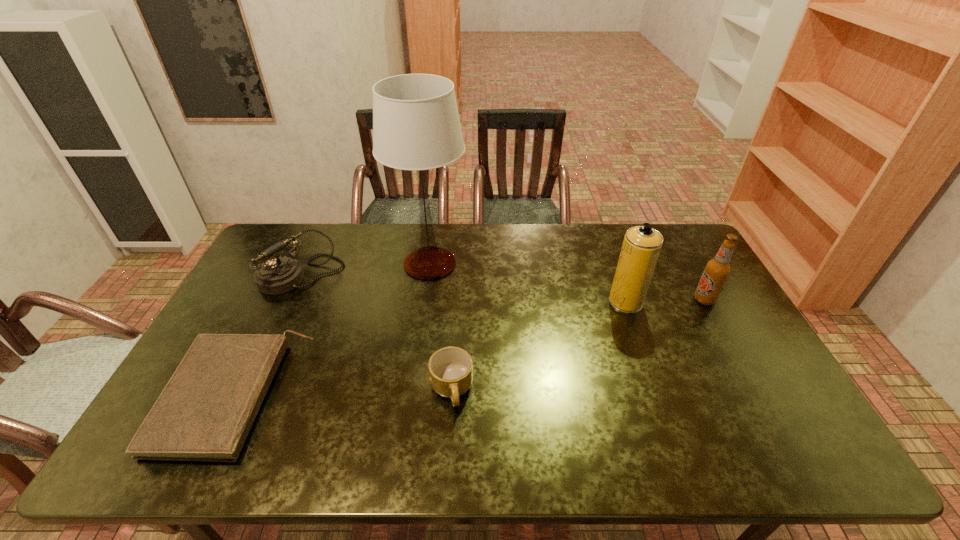
This screenshot has width=960, height=540. Find the location of `free space located on the front label of the rightmost object`. free space located on the front label of the rightmost object is located at coordinates (602, 300).

Locate an element on the screen. Image resolution: width=960 pixels, height=540 pixels. vacant space located 0.230m on the front label of the rightmost object is located at coordinates (620, 300).

What are the coordinates of `vacant region located 0.320m on the front label of the rightmost object` in the screenshot? It's located at (592, 300).

Identify the location of free spot located 0.230m on the front of the fourth tallest object. (263, 357).

Find the location of a particular element. The height and width of the screenshot is (540, 960). free region located 0.120m on the side with the handle of the mug is located at coordinates (447, 463).

The height and width of the screenshot is (540, 960). In order to click on blank space located on the spine side of the shortest object in this screenshot , I will do `click(343, 396)`.

At what (x,y) coordinates should I click in order to perform the action: click on table lamp that is at the far edge. Please return your answer as a coordinate pair (x, y). The height and width of the screenshot is (540, 960). Looking at the image, I should click on (416, 126).

Where is `telephone that is positioned at the far edge`? The width and height of the screenshot is (960, 540). telephone that is positioned at the far edge is located at coordinates (278, 275).

Where is `object located at the near edge`? Image resolution: width=960 pixels, height=540 pixels. object located at the near edge is located at coordinates (205, 412).

Where is `telephone present at the left edge`? telephone present at the left edge is located at coordinates (278, 275).